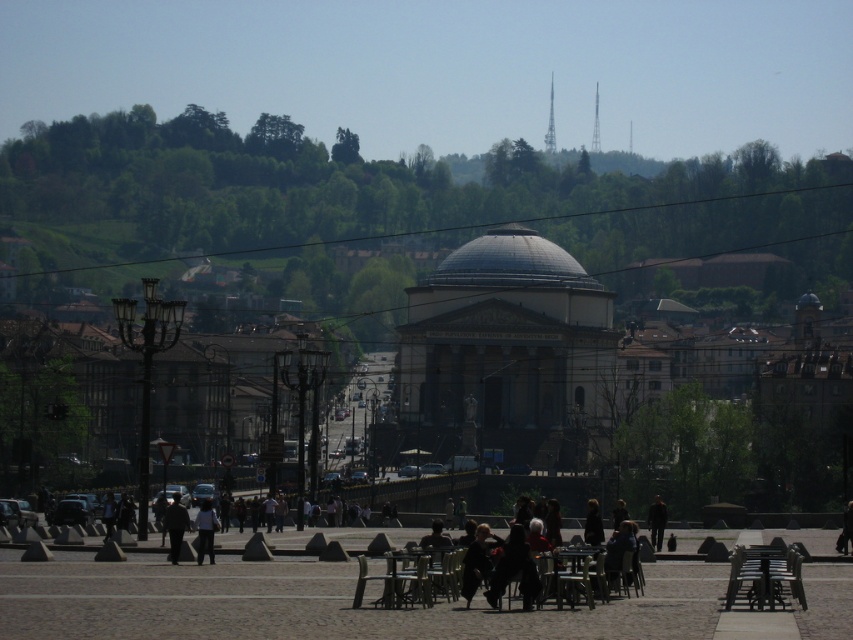
Question: Is dark brown leather jacket at lower right to the right of dark gray jacket at lower center from the viewer's perspective?

Choices:
 (A) no
 (B) yes

Answer: (B)

Question: Does shiny metallic dome at center appear under dark brown leather jacket at center?

Choices:
 (A) yes
 (B) no

Answer: (B)

Question: Can you confirm if white cotton shirt at lower center is positioned to the right of dark gray jacket at lower center?

Choices:
 (A) yes
 (B) no

Answer: (A)

Question: Which of the following is the closest to the observer?

Choices:
 (A) (556, 257)
 (B) (212, 538)
 (C) (654, 532)

Answer: (B)

Question: Which point is farther to the camera?

Choices:
 (A) dark brown leather jacket at center
 (B) dark gray jacket at lower center
 (C) dark brown leather jacket at lower center

Answer: (B)

Question: Which of the following is the closest to the observer?

Choices:
 (A) white cotton shirt at lower center
 (B) shiny metallic dome at center
 (C) dark brown leather jacket at center

Answer: (C)